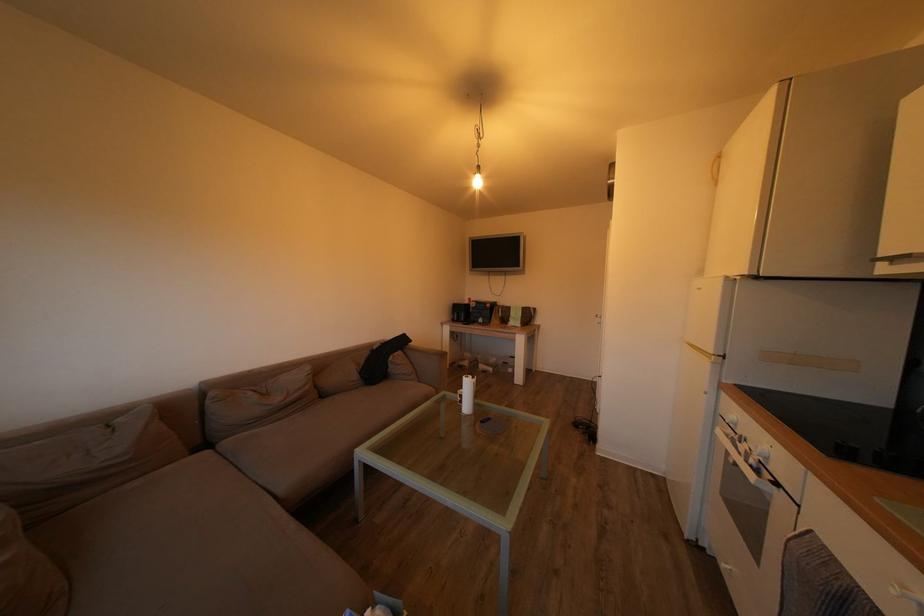
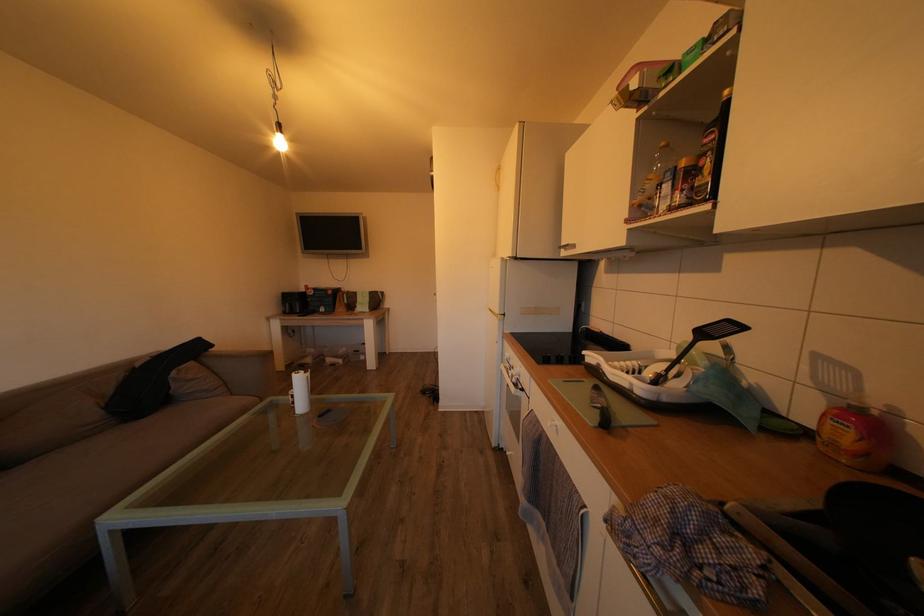
Question: The camera is either moving clockwise (left) or counter-clockwise (right) around the object. The first image is from the beginning of the video and the second image is from the end. Is the camera moving left or right when shooting the video?

Choices:
 (A) Left
 (B) Right

Answer: (A)